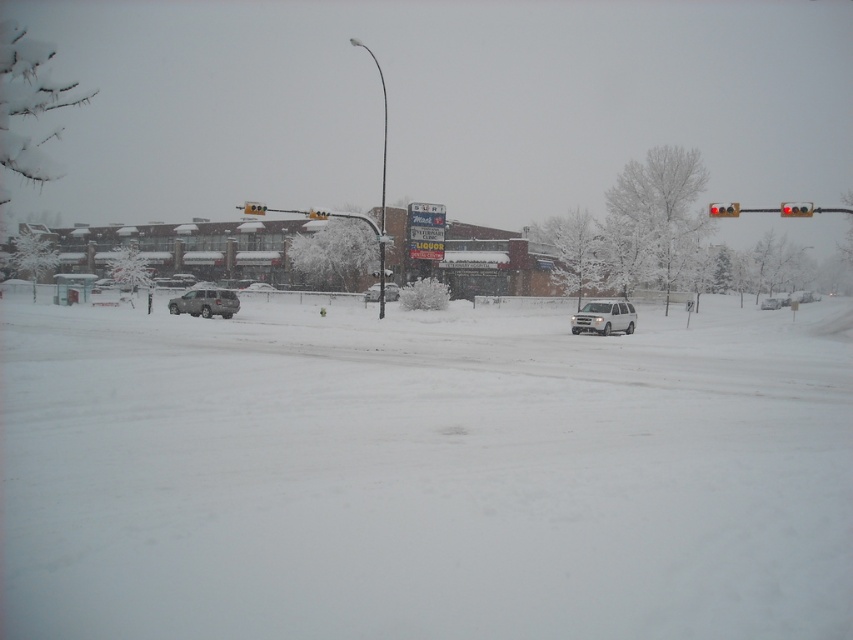
Locate an element on the screen. The image size is (853, 640). silver metallic suv at center is located at coordinates (381, 292).

Can you confirm if silver metallic suv at center is wider than satin silver suv at center?

In fact, silver metallic suv at center might be narrower than satin silver suv at center.

Which is in front, point (393, 292) or point (252, 282)?

Positioned in front is point (393, 292).

Where is `silver metallic suv at center`? The image size is (853, 640). silver metallic suv at center is located at coordinates (381, 292).

Which is below, satin silver suv at left or silver metallic suv at center?

satin silver suv at left

Can you confirm if satin silver suv at left is positioned below silver metallic suv at center?

Yes, satin silver suv at left is below silver metallic suv at center.

You are a GUI agent. You are given a task and a screenshot of the screen. Output one action in this format:
    pyautogui.click(x=<x>, y=<y>)
    Task: Click on the satin silver suv at left
    This screenshot has height=640, width=853.
    Given the screenshot: What is the action you would take?
    pyautogui.click(x=206, y=301)

In order to click on silver metallic suv at center in this screenshot , I will do `click(381, 292)`.

Can you confirm if silver metallic suv at center is wider than green plastic traffic light at upper center?

In fact, silver metallic suv at center might be narrower than green plastic traffic light at upper center.

Between point (376, 288) and point (251, 204), which one is positioned behind?

Positioned behind is point (251, 204).

Find the location of a particular element. The width and height of the screenshot is (853, 640). silver metallic suv at center is located at coordinates (381, 292).